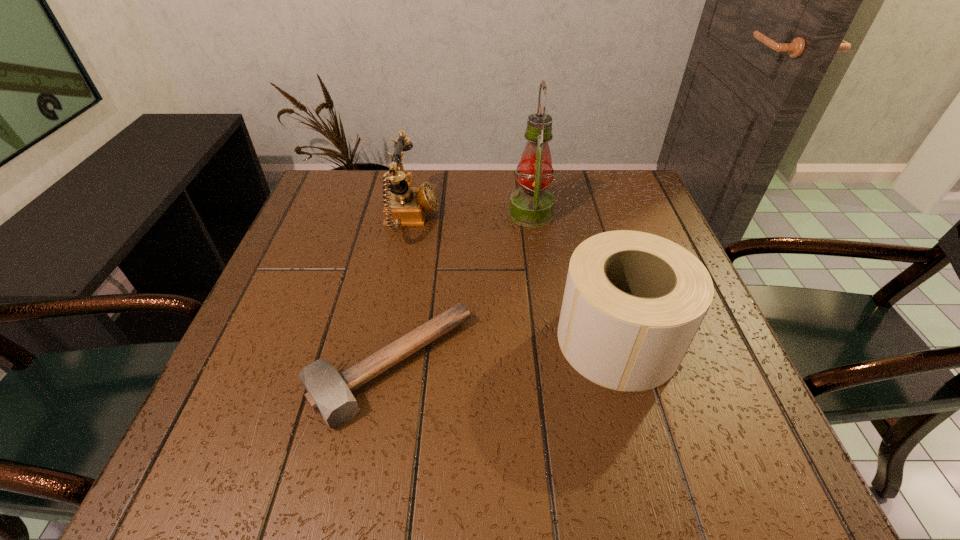
Find the location of a particular element. The height and width of the screenshot is (540, 960). the tallest object is located at coordinates (531, 205).

This screenshot has width=960, height=540. Find the location of `telephone`. telephone is located at coordinates (405, 205).

Where is `toilet tissue`? The image size is (960, 540). toilet tissue is located at coordinates (633, 302).

Where is `mallet`? The image size is (960, 540). mallet is located at coordinates (328, 392).

This screenshot has height=540, width=960. What are the coordinates of `vacant space located 0.210m on the left of the oil lamp` in the screenshot? It's located at (427, 213).

At what (x,y) coordinates should I click in order to perform the action: click on vacant space located on the dial number of the telephone. Please return your answer as a coordinate pair (x, y). The image size is (960, 540). Looking at the image, I should click on (525, 220).

At what (x,y) coordinates should I click in order to perform the action: click on blank space located on the left of the toilet tissue. Please return your answer as a coordinate pair (x, y). Looking at the image, I should click on (380, 340).

I want to click on free space located on the right of the mallet, so click(x=641, y=367).

Identify the location of oil lamp at the far edge. The width and height of the screenshot is (960, 540). (531, 205).

Identify the location of telephone that is at the far edge. This screenshot has width=960, height=540. (405, 205).